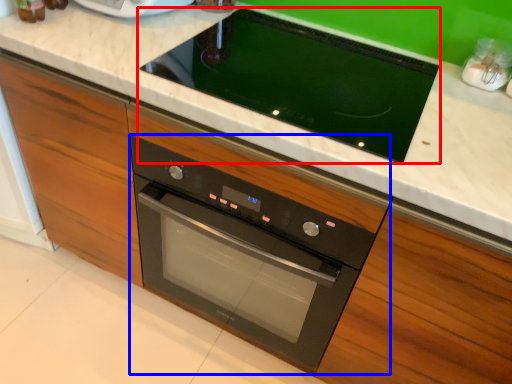
Question: Among these objects, which one is nearest to the camera, home appliance (highlighted by a red box) or oven (highlighted by a blue box)?

Choices:
 (A) home appliance
 (B) oven

Answer: (A)